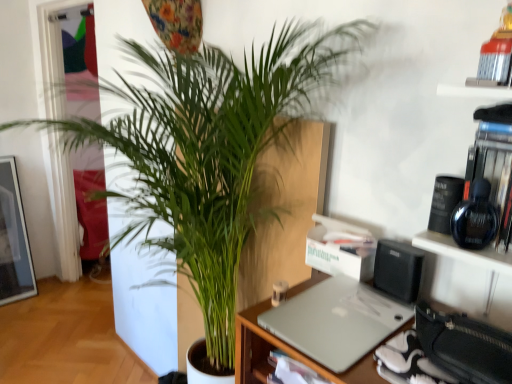
What are the coordinates of `green leafy plant at center` in the screenshot? It's located at (211, 150).

The height and width of the screenshot is (384, 512). Describe the element at coordinates (211, 150) in the screenshot. I see `green leafy plant at center` at that location.

Consider the image. What is the approximate height of green leafy plant at center?

4.18 feet.

Describe the element at coordinates (336, 321) in the screenshot. I see `silver metallic laptop at center` at that location.

What is the approximate width of silver metallic laptop at center?

silver metallic laptop at center is 12.91 inches wide.

Find the location of a particular element. The image size is (512, 384). silver metallic laptop at center is located at coordinates (336, 321).

In order to click on green leafy plant at center in this screenshot , I will do `click(211, 150)`.

Which is more to the right, green leafy plant at center or silver metallic laptop at center?

silver metallic laptop at center.

Considering the relative positions of green leafy plant at center and silver metallic laptop at center in the image provided, is green leafy plant at center behind silver metallic laptop at center?

No.

Which point is more forward, (151,227) or (304,333)?

The point (304,333) is more forward.

From the image's perspective, is green leafy plant at center on top of silver metallic laptop at center?

Indeed, from the image's perspective, green leafy plant at center is shown above silver metallic laptop at center.

From a real-world perspective, which object rests below the other?

From a 3D spatial view, green leafy plant at center is below.

Considering the sizes of objects green leafy plant at center and silver metallic laptop at center in the image provided, who is wider, green leafy plant at center or silver metallic laptop at center?

green leafy plant at center is wider.

Considering the relative sizes of green leafy plant at center and silver metallic laptop at center in the image provided, is green leafy plant at center shorter than silver metallic laptop at center?

No.

Who is smaller, green leafy plant at center or silver metallic laptop at center?

With smaller size is silver metallic laptop at center.

Could silver metallic laptop at center be considered to be inside green leafy plant at center?

Yes, green leafy plant at center contains silver metallic laptop at center.

Would you say green leafy plant at center is a long distance from silver metallic laptop at center?

No, green leafy plant at center is not far from silver metallic laptop at center.

Is green leafy plant at center looking in the opposite direction of silver metallic laptop at center?

green leafy plant at center does not have its back to silver metallic laptop at center.

You are a GUI agent. You are given a task and a screenshot of the screen. Output one action in this format:
    pyautogui.click(x=<x>, y=<y>)
    Task: Click on the laptop on the right side of green leafy plant at center
    The width and height of the screenshot is (512, 384).
    Given the screenshot: What is the action you would take?
    pyautogui.click(x=336, y=321)

Which is more to the left, silver metallic laptop at center or green leafy plant at center?

green leafy plant at center.

Looking at this image, is the depth of silver metallic laptop at center less than that of green leafy plant at center?

That is False.

Which point is more distant from viewer, (325, 314) or (283, 212)?

The point (283, 212) is behind.

From the image's perspective, which one is positioned higher, silver metallic laptop at center or green leafy plant at center?

From the image's view, green leafy plant at center is above.

From a real-world perspective, which object stands above the other?

silver metallic laptop at center.

Is silver metallic laptop at center wider than green leafy plant at center?

Incorrect, the width of silver metallic laptop at center does not surpass that of green leafy plant at center.

From their relative heights in the image, would you say silver metallic laptop at center is taller or shorter than green leafy plant at center?

In the image, silver metallic laptop at center appears to be shorter than green leafy plant at center.

Can you confirm if silver metallic laptop at center is smaller than green leafy plant at center?

Yes.

Would you say silver metallic laptop at center contains green leafy plant at center?

No, silver metallic laptop at center does not contain green leafy plant at center.

Consider the image. Is silver metallic laptop at center positioned far away from green leafy plant at center?

That's not correct — silver metallic laptop at center is a little close to green leafy plant at center.

Is silver metallic laptop at center oriented towards green leafy plant at center?

No, silver metallic laptop at center is not aimed at green leafy plant at center.

This screenshot has height=384, width=512. Identify the location of houseplant directly beneath the silver metallic laptop at center (from a real-world perspective). (211, 150).

Find the location of a particular element. houseplant on the left of silver metallic laptop at center is located at coordinates (211, 150).

There is a green leafy plant at center. Where is `laptop above it (from a real-world perspective)`? This screenshot has width=512, height=384. laptop above it (from a real-world perspective) is located at coordinates (336, 321).